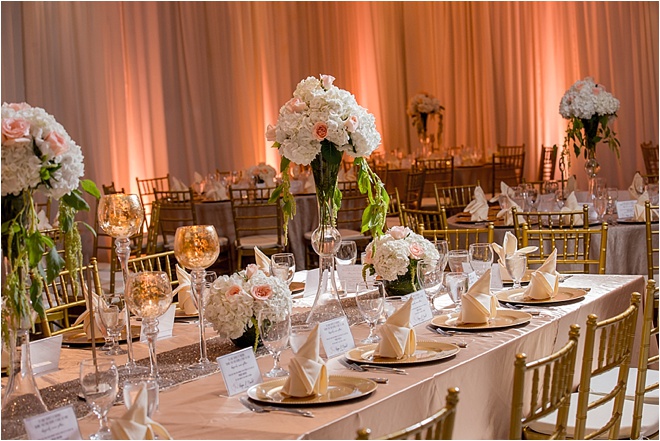
At what (x,y) coordinates should I click in order to perform the action: click on flower pots. Please return your answer as a coordinate pair (x, y). Looking at the image, I should click on (404, 288), (246, 338).